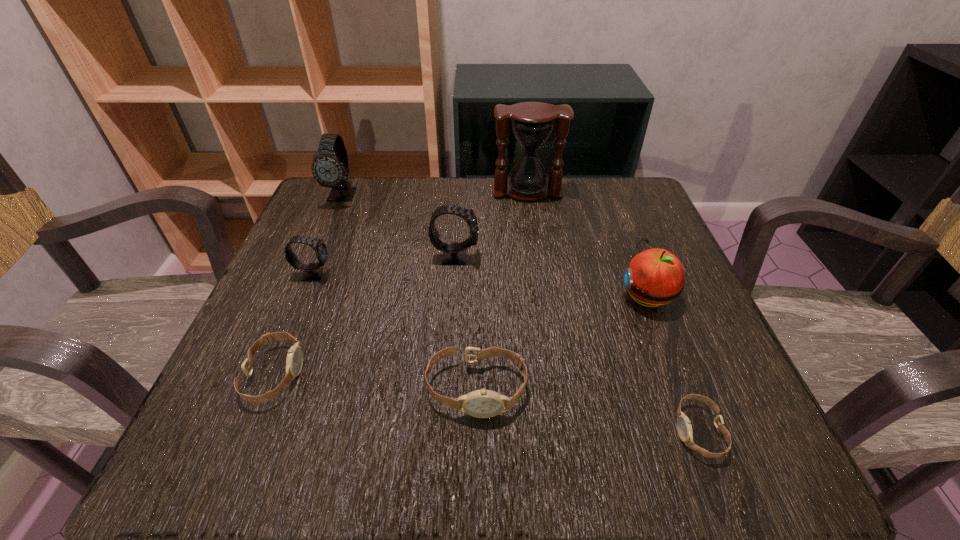
What are the coordinates of `vacant space located 0.050m on the face of the biggest beige watch` in the screenshot? It's located at (476, 453).

I want to click on vacant region located on the face of the leftmost beige watch, so click(511, 375).

The width and height of the screenshot is (960, 540). I want to click on free location located on the face of the rightmost beige watch, so click(620, 431).

This screenshot has width=960, height=540. Find the location of `vacant space located 0.220m on the face of the rightmost beige watch`. vacant space located 0.220m on the face of the rightmost beige watch is located at coordinates (521, 431).

Where is `vacant space situated 0.400m on the face of the rightmost beige watch`? vacant space situated 0.400m on the face of the rightmost beige watch is located at coordinates (395, 431).

Find the location of `hourglass located at the far edge`. hourglass located at the far edge is located at coordinates (532, 123).

Where is `watch present at the far edge`? watch present at the far edge is located at coordinates (330, 167).

This screenshot has height=540, width=960. I want to click on apple positioned at the right edge, so click(x=654, y=277).

Where is `watch that is positioned at the right edge`? Image resolution: width=960 pixels, height=540 pixels. watch that is positioned at the right edge is located at coordinates (684, 427).

You are a GUI agent. You are given a task and a screenshot of the screen. Output one action in this format:
    pyautogui.click(x=<x>, y=<y>)
    Task: Click on the object present at the far left corner
    The width and height of the screenshot is (960, 540).
    Given the screenshot: What is the action you would take?
    pyautogui.click(x=330, y=167)